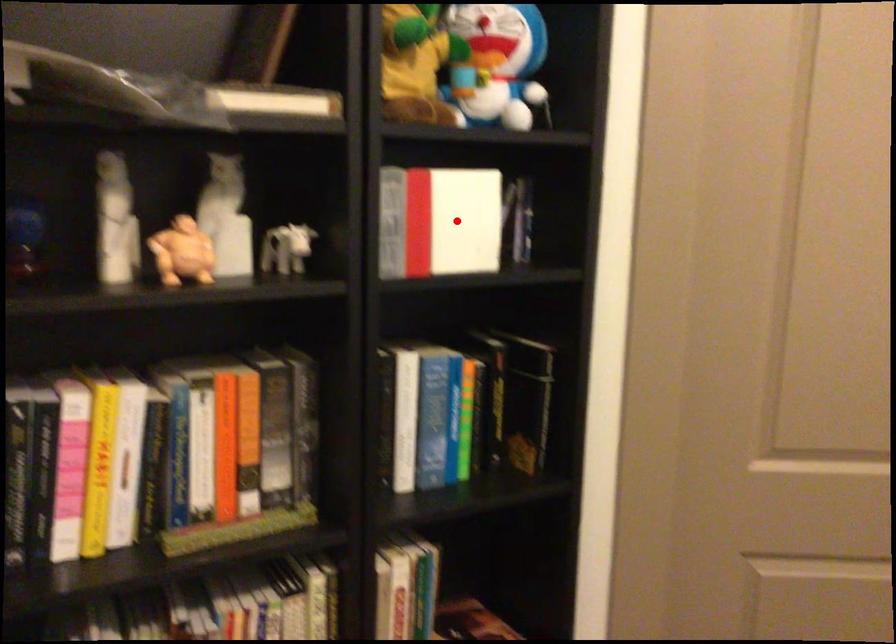
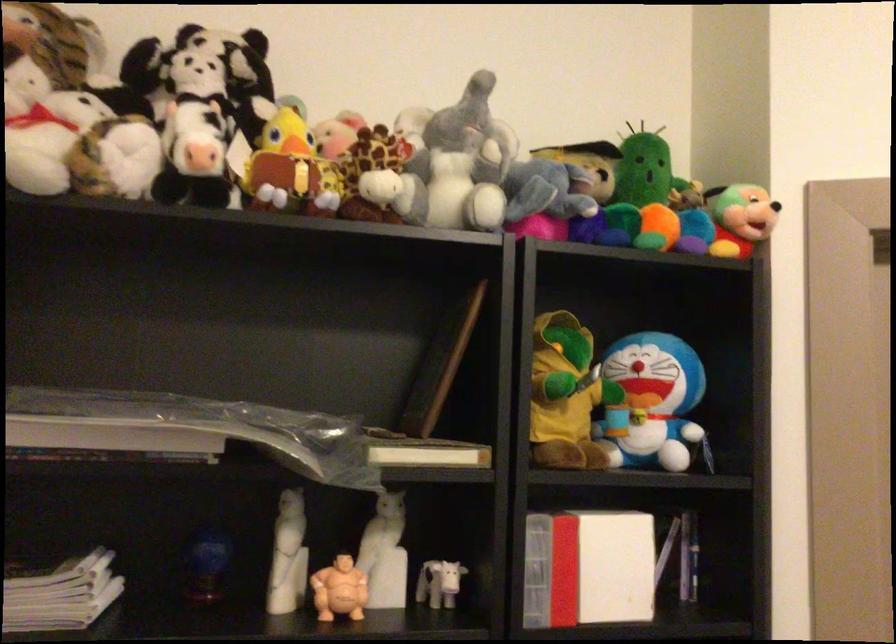
Locate, in the second image, the point that corresponds to the highlighted location in the first image.

(609, 565)